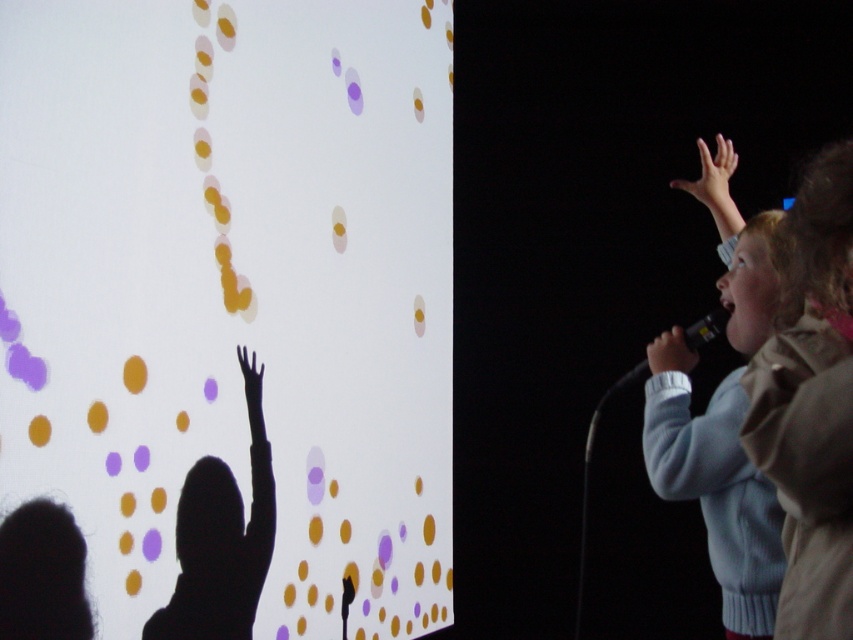
Question: Is light blue sweater at right smaller than silhouette figure at left?

Choices:
 (A) no
 (B) yes

Answer: (A)

Question: Can you confirm if light blue sweater at right is wider than matte black hand at upper right?

Choices:
 (A) yes
 (B) no

Answer: (A)

Question: Can you confirm if light brown jacket at right is positioned to the left of silhouette figure at left?

Choices:
 (A) yes
 (B) no

Answer: (B)

Question: Which is nearer to the smooth skin hand at upper right?

Choices:
 (A) silhouette figure at left
 (B) black matte microphone at right
 (C) black matte hand at upper left
 (D) light brown jacket at right

Answer: (B)

Question: Which point is closer to the camera?

Choices:
 (A) (796, 588)
 (B) (740, 577)

Answer: (A)

Question: Which of the following is the closest to the observer?

Choices:
 (A) light brown jacket at right
 (B) smooth skin hand at upper right
 (C) silhouette figure at left
 (D) black matte hand at upper left

Answer: (A)